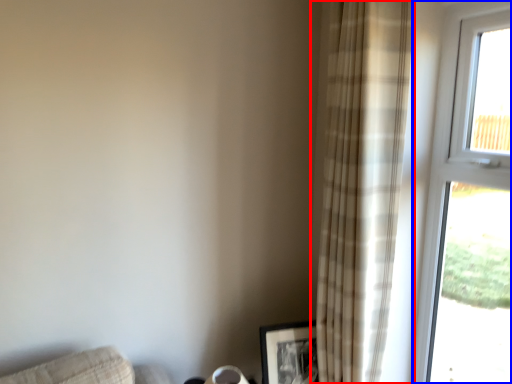
Question: Among these objects, which one is nearest to the camera, curtain (highlighted by a red box) or window (highlighted by a blue box)?

Choices:
 (A) curtain
 (B) window

Answer: (B)